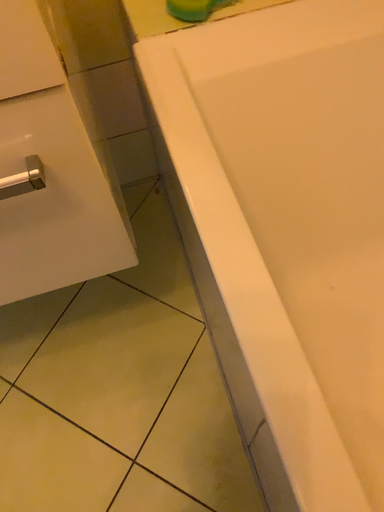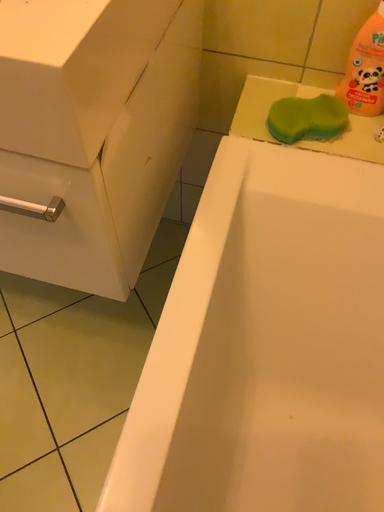
Question: How did the camera likely rotate when shooting the video?

Choices:
 (A) rotated upward
 (B) rotated downward

Answer: (A)